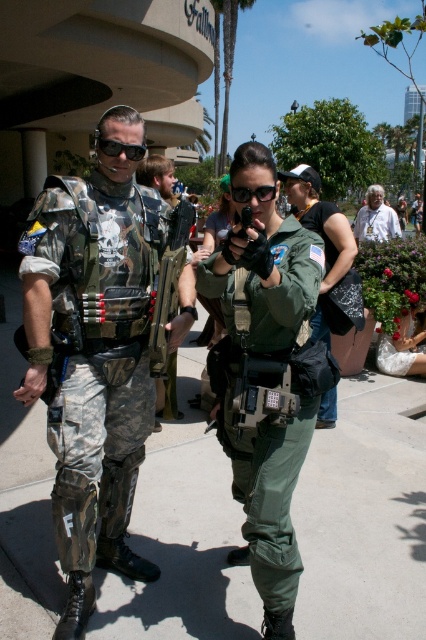
Question: Does green matte uniform at center have a larger size compared to matte black goggles at left?

Choices:
 (A) no
 (B) yes

Answer: (B)

Question: Which is farther from the matte black goggles at left?

Choices:
 (A) matte black gun at center
 (B) green matte flight suit at center
 (C) camouflage fabric armor at left
 (D) green matte goggles at center

Answer: (B)

Question: Is camouflage fabric armor at left below green matte flight suit at center?

Choices:
 (A) no
 (B) yes

Answer: (B)

Question: Does matte black gun at center come in front of green fabric uniform at center?

Choices:
 (A) no
 (B) yes

Answer: (B)

Question: Which point is farther to the camera?

Choices:
 (A) (256, 189)
 (B) (140, 148)
 (C) (382, 205)
 (D) (94, 304)

Answer: (C)

Question: Which of these objects is positioned farthest from the matte black goggles at left?

Choices:
 (A) green matte uniform at center
 (B) green matte flight suit at center
 (C) green fabric uniform at center

Answer: (C)